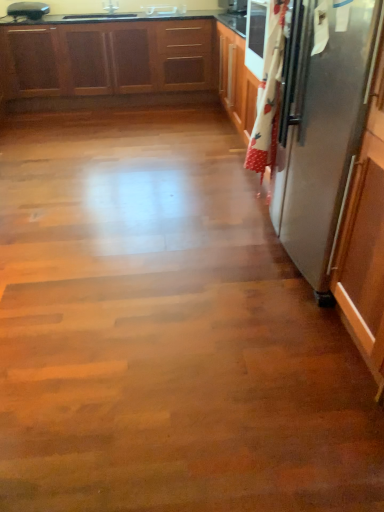
Question: In terms of size, does wooden cabinets at upper left appear bigger or smaller than white glossy sink at upper center?

Choices:
 (A) small
 (B) big

Answer: (B)

Question: From a real-world perspective, is wooden cabinets at upper left above or below white glossy sink at upper center?

Choices:
 (A) above
 (B) below

Answer: (B)

Question: Estimate the real-world distances between objects in this image. Which object is farther from the white glossy sink at upper center?

Choices:
 (A) satin silver refrigerator at right
 (B) metallic silver toaster at upper left
 (C) wooden cabinets at upper left

Answer: (A)

Question: Which object is the closest to the satin silver refrigerator at right?

Choices:
 (A) metallic silver toaster at upper left
 (B) wooden cabinets at upper left
 (C) white glossy sink at upper center

Answer: (B)